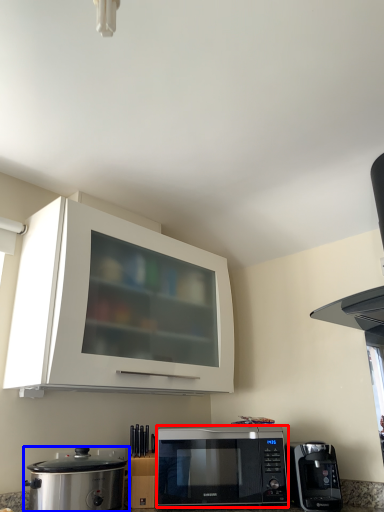
Question: Which point is further to the camera, microwave oven (highlighted by a red box) or home appliance (highlighted by a blue box)?

Choices:
 (A) microwave oven
 (B) home appliance

Answer: (A)